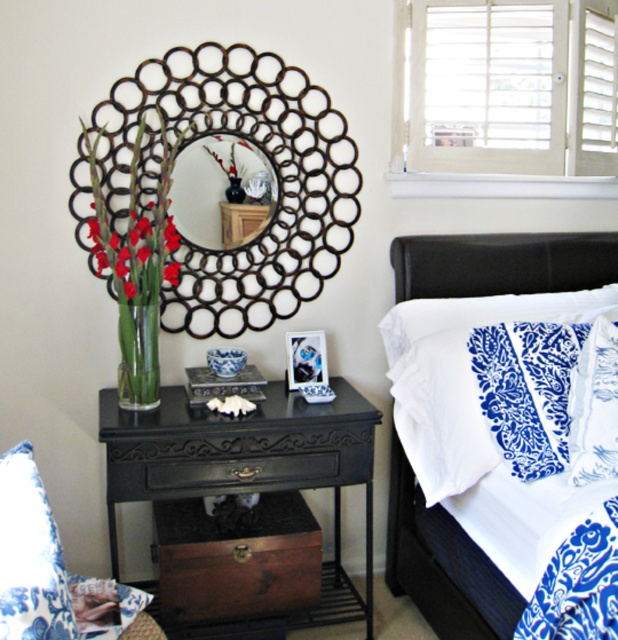
You are a photographer standing in the bedroom corner. You want to capture a closeup shot of the blue printed fabric pillow at lower left without moving any furniture. Can you get close enough to the pillow to take the shot?

The distance between the blue printed fabric pillow at lower left and the camera is 3.41 feet, so yes, you can get close enough to take the closeup shot since the distance is manageable.

You are arranging flowers in the black glass vase at upper center and need to place a decorative pillow nearby. According to the scene, where should you place the blue printed fabric pillow at lower left to maintain the existing arrangement?

The blue printed fabric pillow at lower left should be placed below the black glass vase at upper center to maintain the existing arrangement.

You are standing in the bedroom corner and want to place a small decoration on the white damask fabric at center. Where exactly should you place it?

The white damask fabric at center is located at point (442, 564), so you should place the decoration there.